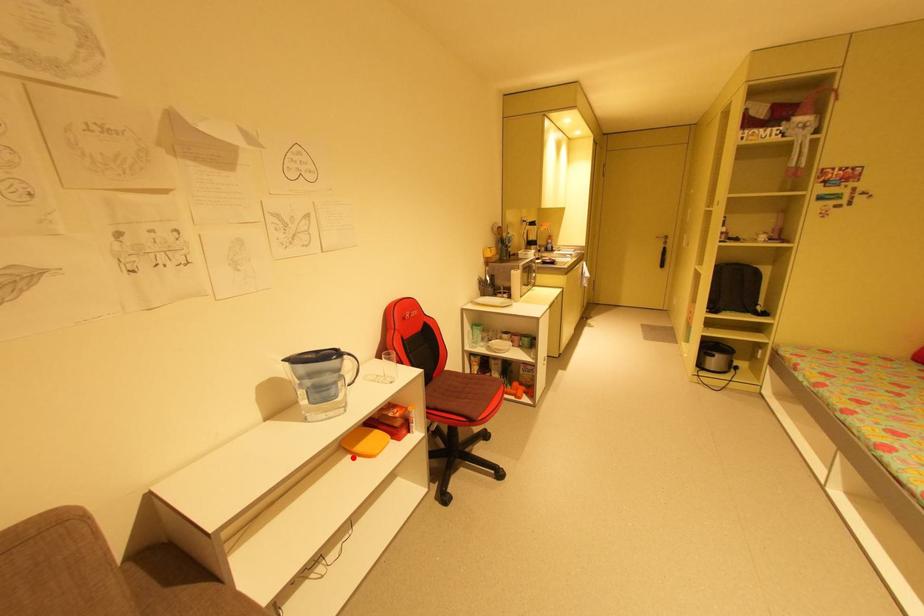
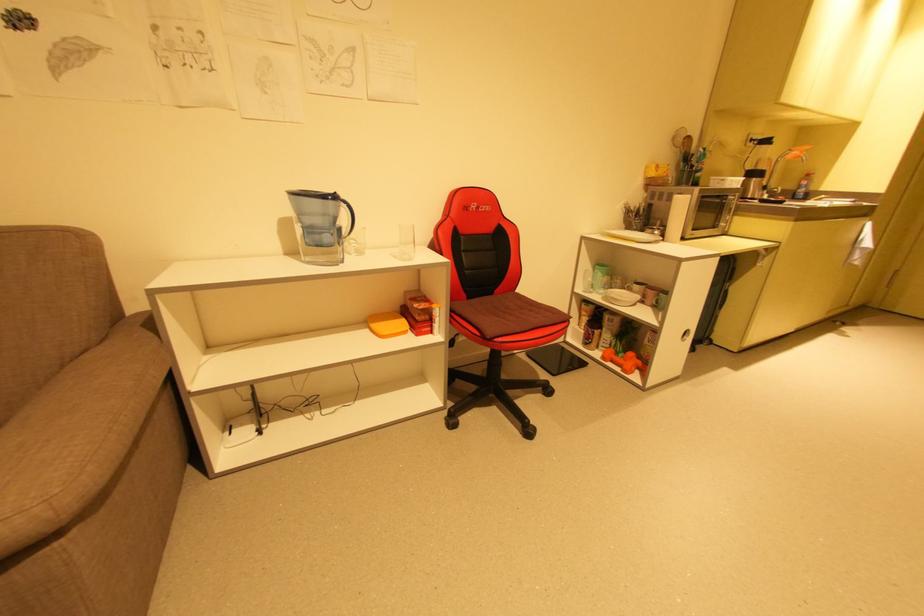
Locate, in the second image, the point that corresponds to the highlighted location in the first image.

(371, 331)